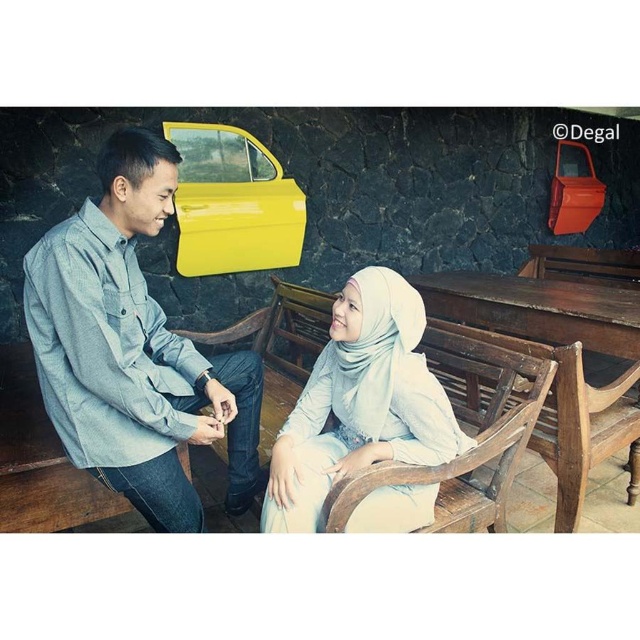
You are a photographer setting up for a portrait. You need to ensure that the light gray denim shirt at left and the yellow matte car door at upper center are both in focus. Which object should you focus on first to ensure both are sharp?

You should focus on the light gray denim shirt at left first since it is closer to the viewer than the yellow matte car door at upper center. By focusing on the closer object, the depth of field will extend backward, potentially keeping both in focus.

You are a photographer trying to capture a photo of the light gray denim shirt at left and the yellow matte car door at upper center. Which object should you focus on first if you want to ensure both are in the frame without moving the camera?

The light gray denim shirt at left is taller than the yellow matte car door at upper center, so you should focus on the light gray denim shirt at left first to ensure both are in the frame without moving the camera.